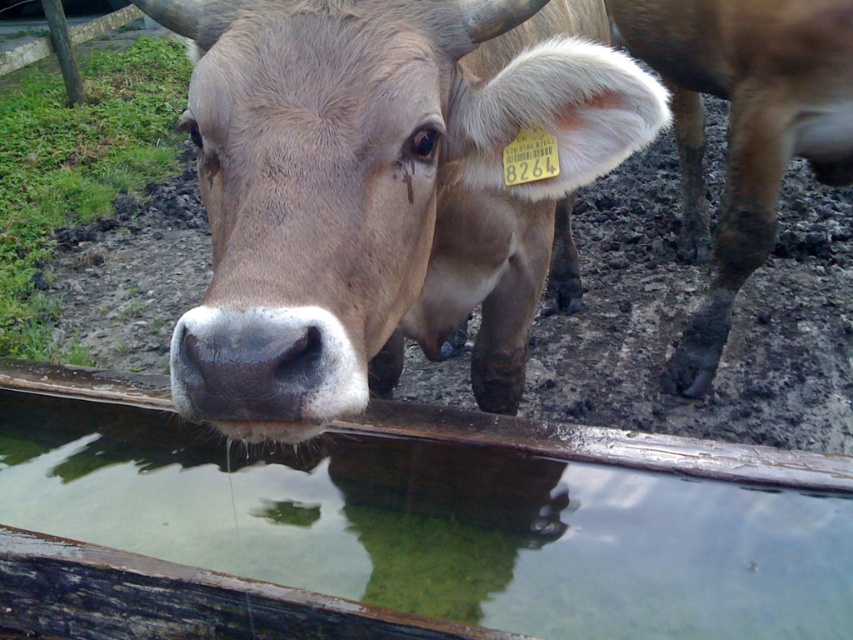
Question: Which point appears farthest from the camera in this image?

Choices:
 (A) (697, 586)
 (B) (717, 227)

Answer: (B)

Question: Can you confirm if clear water at center is smaller than brown matte cow at center?

Choices:
 (A) no
 (B) yes

Answer: (B)

Question: Which object is positioned closest to the clear water at center?

Choices:
 (A) brown matte cow at center
 (B) brown muddy leg at lower right

Answer: (A)

Question: Which point is farther to the camera?

Choices:
 (A) brown matte cow at center
 (B) clear water at center

Answer: (B)

Question: Can you confirm if brown matte cow at center is bigger than brown muddy leg at lower right?

Choices:
 (A) yes
 (B) no

Answer: (A)

Question: Is clear water at center to the right of brown matte cow at center from the viewer's perspective?

Choices:
 (A) yes
 (B) no

Answer: (B)